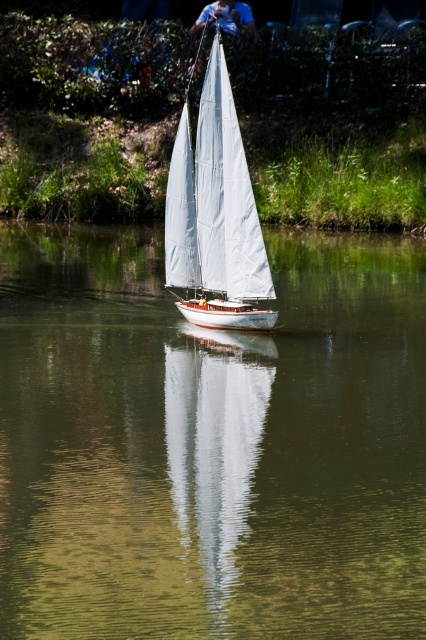
Question: Which point is farther from the camera taking this photo?

Choices:
 (A) pos(241,161)
 (B) pos(118,547)

Answer: (A)

Question: Is green reflective water at center below white canvas sailboat at center?

Choices:
 (A) yes
 (B) no

Answer: (A)

Question: Does green reflective water at center appear on the left side of white canvas sailboat at center?

Choices:
 (A) yes
 (B) no

Answer: (B)

Question: Can you confirm if green reflective water at center is smaller than white canvas sailboat at center?

Choices:
 (A) no
 (B) yes

Answer: (A)